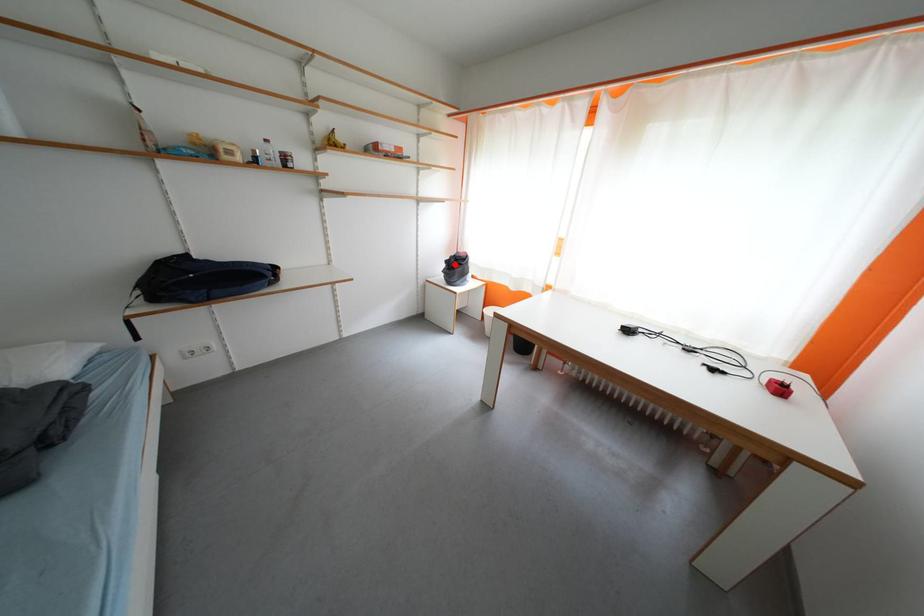
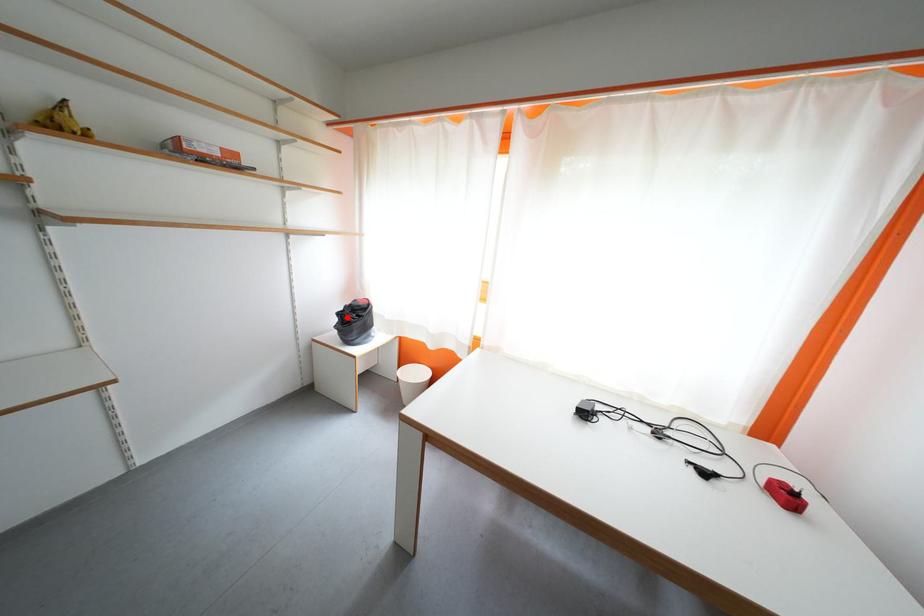
I am providing you with two images of the same scene from different viewpoints. A red point is marked on the first image and another point is marked on the second image. Are the points marked in image1 and image2 representing the same 3D position?

Yes